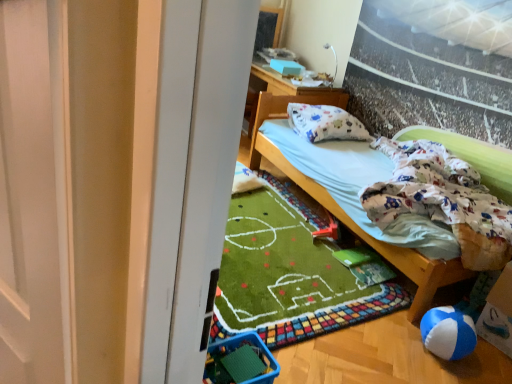
Question: Does white cotton pillow at upper center turn towards blue sponge ball at lower right?

Choices:
 (A) yes
 (B) no

Answer: (B)

Question: From the image's perspective, would you say white cotton pillow at upper center is shown under blue sponge ball at lower right?

Choices:
 (A) no
 (B) yes

Answer: (A)

Question: Is white cotton pillow at upper center far from blue sponge ball at lower right?

Choices:
 (A) no
 (B) yes

Answer: (B)

Question: Does white cotton pillow at upper center appear on the right side of blue sponge ball at lower right?

Choices:
 (A) no
 (B) yes

Answer: (A)

Question: From a real-world perspective, is white cotton pillow at upper center beneath blue sponge ball at lower right?

Choices:
 (A) no
 (B) yes

Answer: (A)

Question: Is the position of white cotton pillow at upper center more distant than that of blue sponge ball at lower right?

Choices:
 (A) yes
 (B) no

Answer: (A)

Question: Is red plastic toy at lower center oriented towards white cotton pillow at upper center?

Choices:
 (A) no
 (B) yes

Answer: (A)

Question: From the image's perspective, is red plastic toy at lower center located above white cotton pillow at upper center?

Choices:
 (A) yes
 (B) no

Answer: (B)

Question: Is red plastic toy at lower center positioned far away from white cotton pillow at upper center?

Choices:
 (A) no
 (B) yes

Answer: (A)

Question: Considering the relative sizes of red plastic toy at lower center and white cotton pillow at upper center in the image provided, is red plastic toy at lower center taller than white cotton pillow at upper center?

Choices:
 (A) no
 (B) yes

Answer: (A)

Question: Does red plastic toy at lower center touch white cotton pillow at upper center?

Choices:
 (A) no
 (B) yes

Answer: (A)

Question: Is red plastic toy at lower center bigger than white cotton pillow at upper center?

Choices:
 (A) no
 (B) yes

Answer: (A)

Question: Does white cotton pillow at upper center turn towards white cotton mattress at center?

Choices:
 (A) no
 (B) yes

Answer: (A)